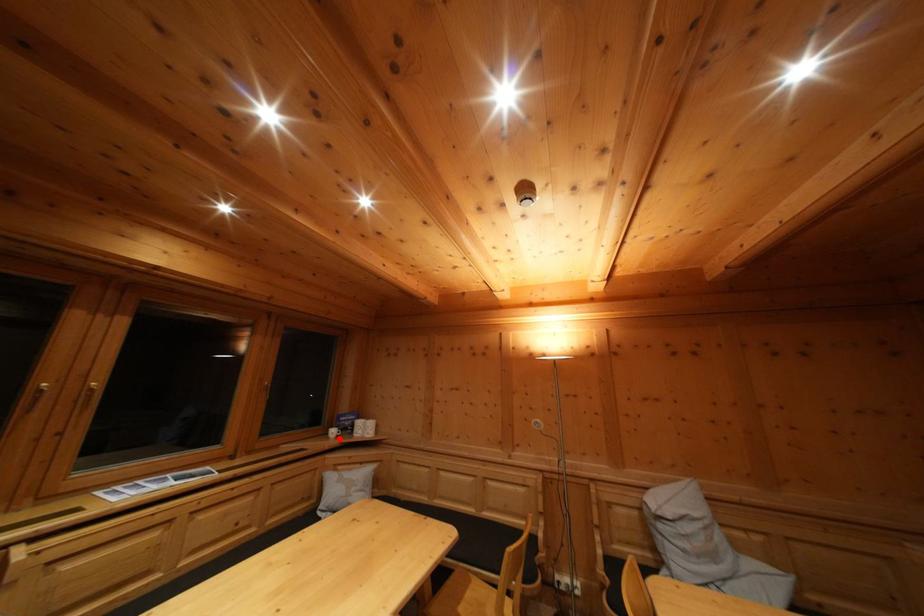
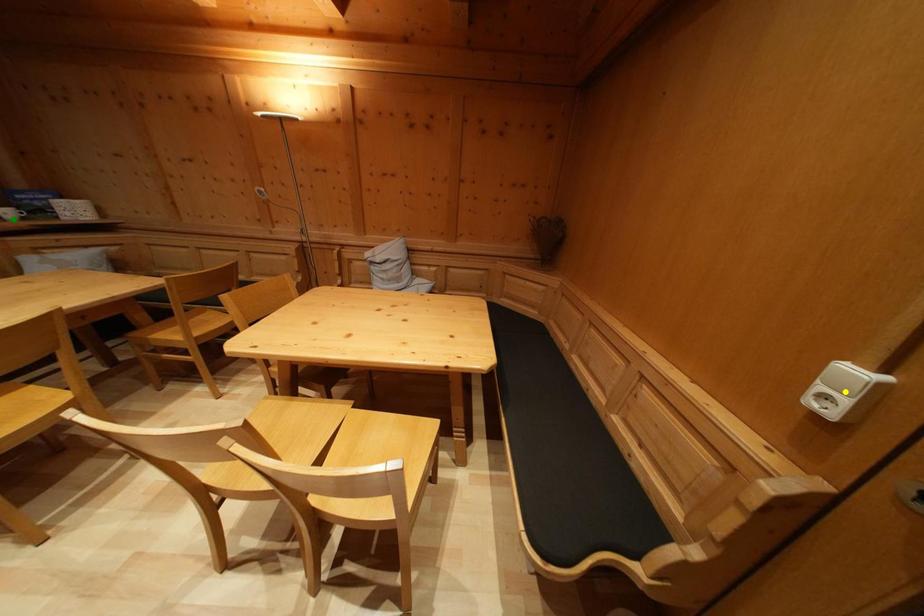
Question: I am providing you with two images of the same scene from different viewpoints. A red point is marked on the first image. You are given multiple points on the second image. In image 2, which mark is for the same physical point as the one in image 1?

Choices:
 (A) blue point
 (B) yellow point
 (C) green point

Answer: (C)